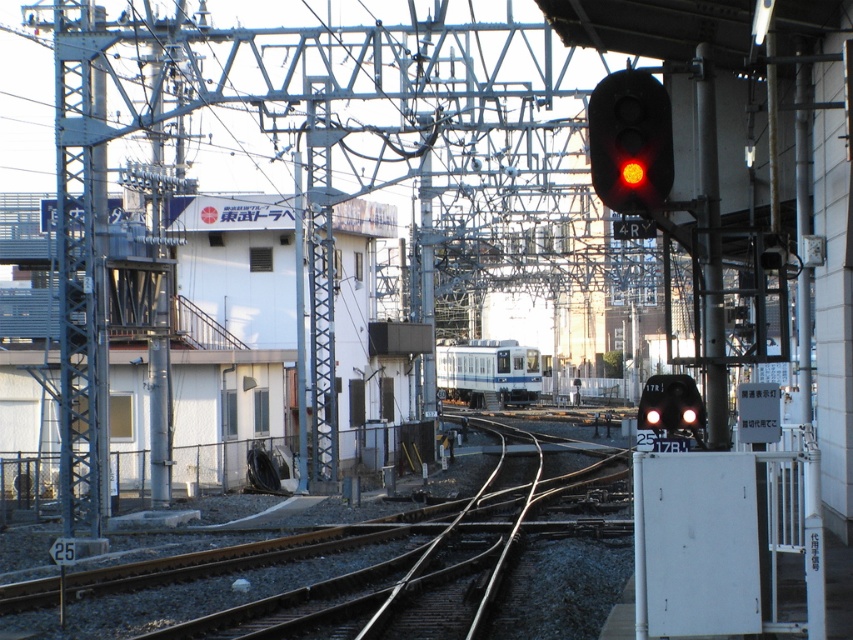
Question: Can you confirm if matte black signal light at upper right is positioned to the right of black glossy train at right?

Choices:
 (A) yes
 (B) no

Answer: (B)

Question: Estimate the real-world distances between objects in this image. Which object is farther from the matte black signal light at upper right?

Choices:
 (A) white glossy train at center
 (B) black glossy train at right

Answer: (A)

Question: Which point is farther from the camera taking this photo?

Choices:
 (A) (x=453, y=369)
 (B) (x=650, y=177)

Answer: (A)

Question: Does matte black signal light at upper right have a greater width compared to black glossy train at right?

Choices:
 (A) no
 (B) yes

Answer: (A)

Question: Does white glossy train at center have a smaller size compared to black glossy train at right?

Choices:
 (A) no
 (B) yes

Answer: (A)

Question: Which point is farther to the camera?

Choices:
 (A) white glossy train at center
 (B) black glossy train at right
 (C) matte black signal light at upper right

Answer: (A)